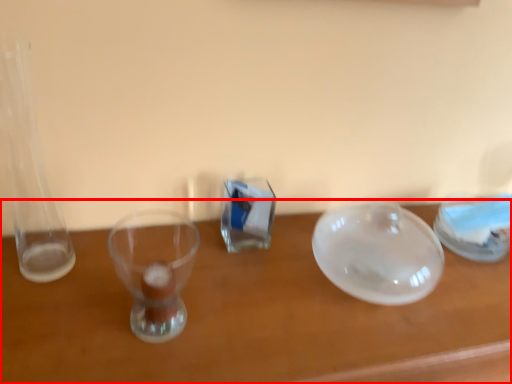
Question: Observing the image, what is the correct spatial positioning of table (annotated by the red box) in reference to tableware?

Choices:
 (A) right
 (B) left

Answer: (B)